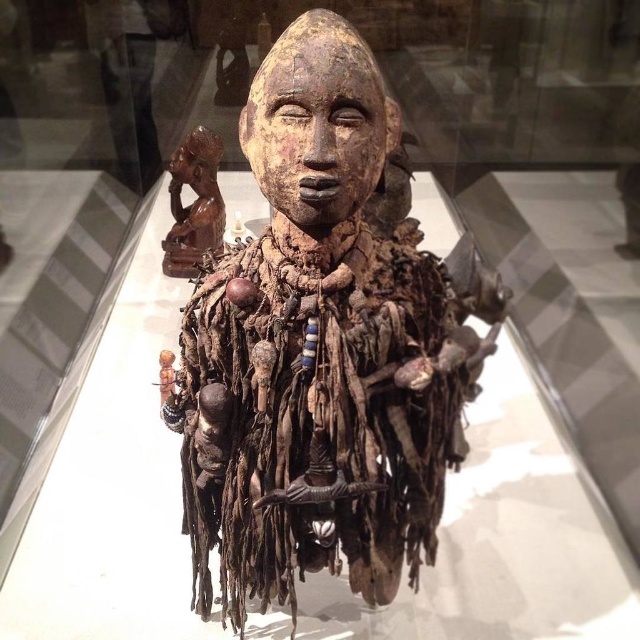
You are an art student observing the museum exhibit. You see the wooden carved head at center and the matte brown wooden head at upper left. Which one is positioned higher up in the image?

The matte brown wooden head at upper left is positioned higher up in the image than the wooden carved head at center.

You are a museum curator who needs to place a protective glass case around the wooden carved head at center. The case requires a minimum of 4 feet of clearance from the nearest object. Is the distance sufficient?

The wooden carved head at center is 4.41 feet away from the nearest object, which is more than the required 4 feet clearance. Therefore, the protective glass case can be safely placed around the wooden carved head at center.

You are a museum visitor standing in front of the sculpture. You notice the brown wooden figurine at upper left and the matte brown wooden head at upper left. Which object is positioned lower in the image?

The brown wooden figurine at upper left is positioned lower than the matte brown wooden head at upper left.